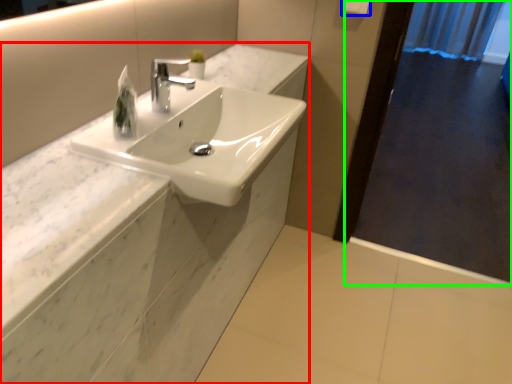
Question: Based on their relative distances, which object is nearer to counter (highlighted by a red box)? Choose from towel bar (highlighted by a blue box) and screen door (highlighted by a green box).

Choices:
 (A) towel bar
 (B) screen door

Answer: (A)